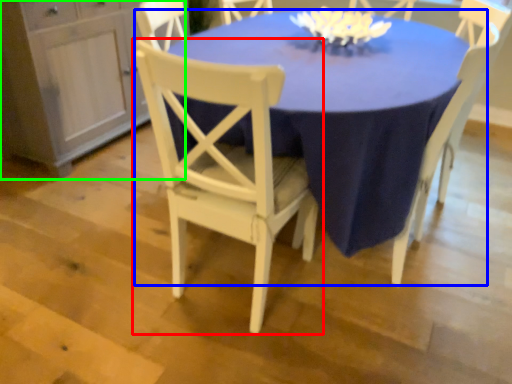
Question: Which object is the farthest from chair (highlighted by a red box)? Choose among these: table (highlighted by a blue box) or dresser (highlighted by a green box).

Choices:
 (A) table
 (B) dresser

Answer: (B)